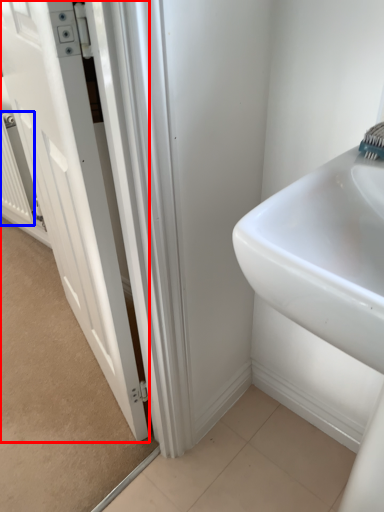
Question: Which point is further to the camera, door (highlighted by a red box) or radiator (highlighted by a blue box)?

Choices:
 (A) door
 (B) radiator

Answer: (B)